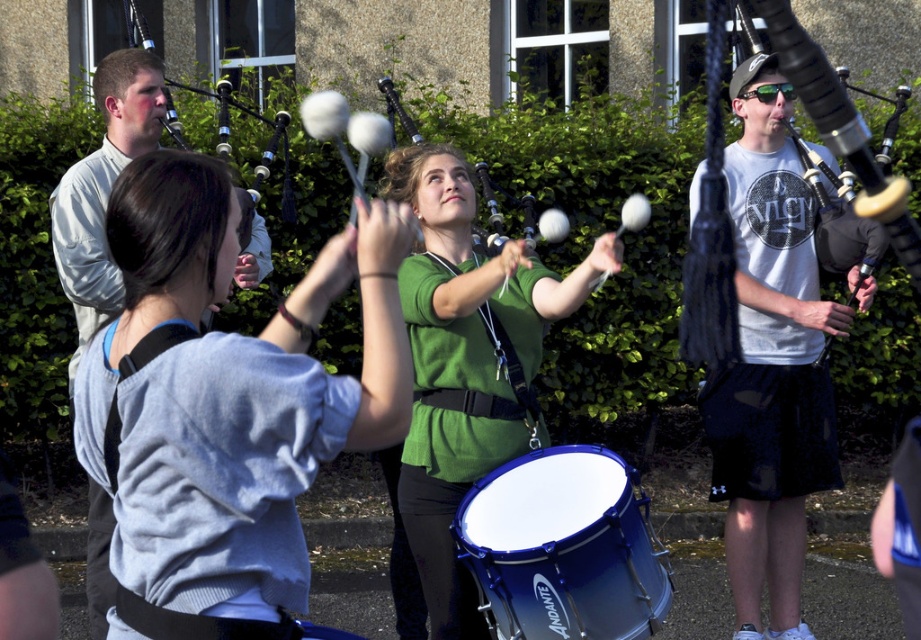
Question: Is blue metallic drum at center wider than matte black bagpipes at right?

Choices:
 (A) no
 (B) yes

Answer: (B)

Question: Is blue metallic drum at center thinner than matte black bagpipes at right?

Choices:
 (A) no
 (B) yes

Answer: (A)

Question: Considering the real-world distances, which object is closest to the light blue sweater at center?

Choices:
 (A) matte black bagpipes at right
 (B) green matte shirt at center
 (C) white t-shirt at upper right
 (D) blue metallic drum at center

Answer: (A)

Question: Does green matte shirt at center have a larger size compared to blue metallic drum at center?

Choices:
 (A) yes
 (B) no

Answer: (A)

Question: Which of the following is the farthest from the observer?

Choices:
 (A) (82, 372)
 (B) (855, 161)
 (C) (463, 204)
 (D) (57, 248)

Answer: (D)

Question: Which object is positioned closest to the matte black bagpipes at right?

Choices:
 (A) light blue sweater at center
 (B) white t-shirt at upper right
 (C) green matte shirt at center

Answer: (A)